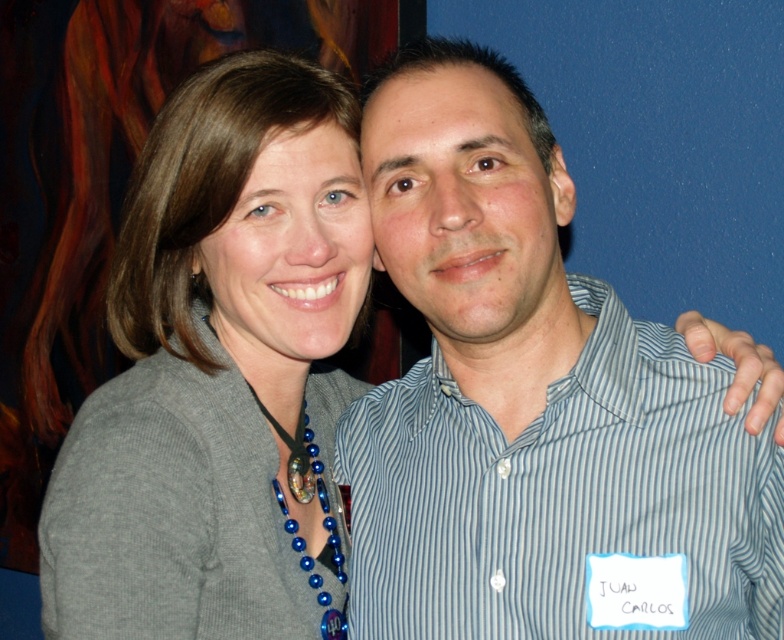
You are taking a photo of two people standing side by side. You notice the blue striped shirt at center and the gray knitted sweater at upper left. Which clothing item is positioned higher in the image?

The blue striped shirt at center is located above the gray knitted sweater at upper left, so it is positioned higher in the image.

Consider the image. You are a photographer trying to adjust the lighting for a group photo. You notice the blue striped shirt at center and the gray knitted sweater at upper left. Which clothing item requires more space in the frame to avoid being cut off?

The blue striped shirt at center requires more space in the frame because its width surpasses that of the gray knitted sweater at upper left, so it is wider and more likely to be cut off if not properly framed.

You are a photographer trying to adjust the lighting for a group photo. You notice two clothing items in the scene. The blue striped shirt at center and the gray knitted sweater at upper left. Which clothing item is positioned to the right side of the other?

The blue striped shirt at center is positioned to the right of the gray knitted sweater at upper left according to the description.